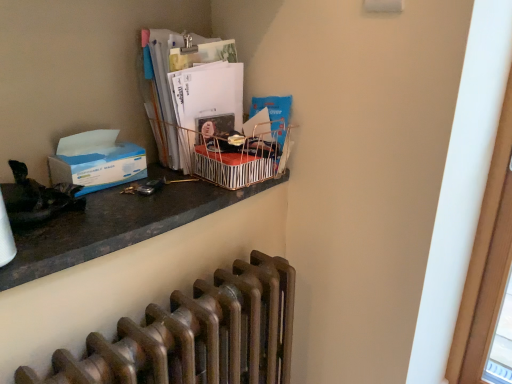
Locate an element on the screen. This screenshot has width=512, height=384. free spot above bronze metallic radiator at lower center (from a real-world perspective) is located at coordinates (183, 311).